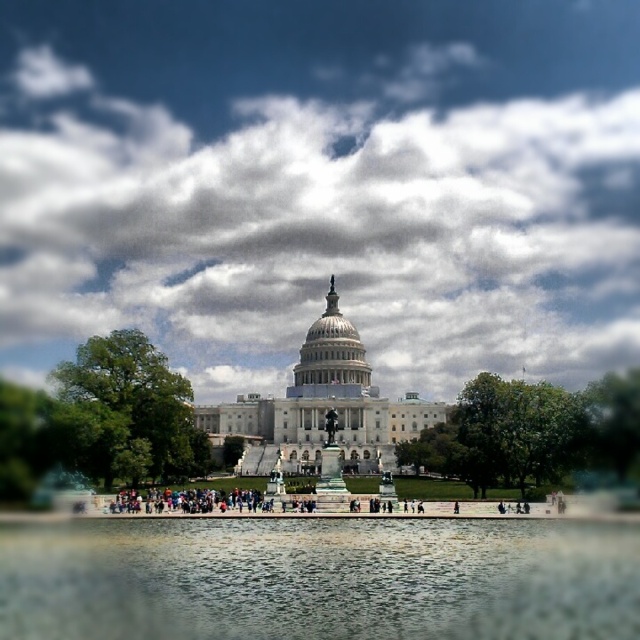
You are standing at the point marked by point (321, 227), which is the location of a white fluffy cloud at center. Looking around, what is the most prominent structure you can see in the scene?

The most prominent structure is the United States Capitol Building with its large dome at the center, flanked by two wings, as described in the scene.

You are standing in front of the United States Capitol Building and notice a white fluffy cloud at center and a clear glass water at center. Which object is positioned higher in the scene?

The white fluffy cloud at center is positioned higher than the clear glass water at center.

Looking at this image, you are standing in front of the United States Capitol Building and notice a white fluffy cloud at center and a clear glass water at center. Which object is positioned to the left?

The white fluffy cloud at center is to the left of clear glass water at center, so the white fluffy cloud at center is positioned to the left.